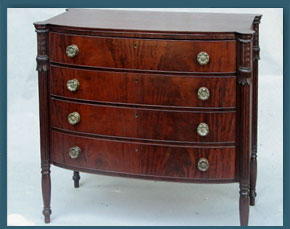
At what (x,y) coordinates should I click in order to perform the action: click on top drawer. Please return your answer as a coordinate pair (x, y). This screenshot has height=229, width=290. Looking at the image, I should click on (136, 43).